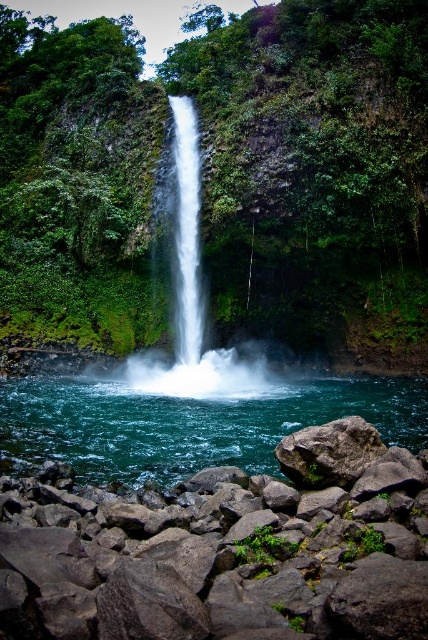
Question: Which point is closer to the camera?

Choices:
 (A) (109, 465)
 (B) (157, 593)

Answer: (B)

Question: Which is farther from the clear blue water at center?

Choices:
 (A) gray rough rock at center
 (B) white smooth waterfall at center

Answer: (B)

Question: Can you confirm if white smooth waterfall at center is positioned above gray rough rock at center?

Choices:
 (A) yes
 (B) no

Answer: (A)

Question: Can you confirm if green leafy vegetation at center is positioned to the right of smooth gray rock at lower left?

Choices:
 (A) no
 (B) yes

Answer: (A)

Question: Does clear blue water at center come in front of gray rough rock at center?

Choices:
 (A) yes
 (B) no

Answer: (B)

Question: Which of the following is the closest to the observer?

Choices:
 (A) clear blue water at center
 (B) white smooth waterfall at center

Answer: (A)